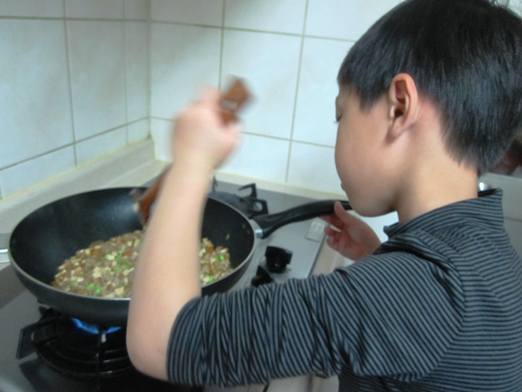
This screenshot has width=522, height=392. Identify the location of knobs. (259, 269), (274, 255).